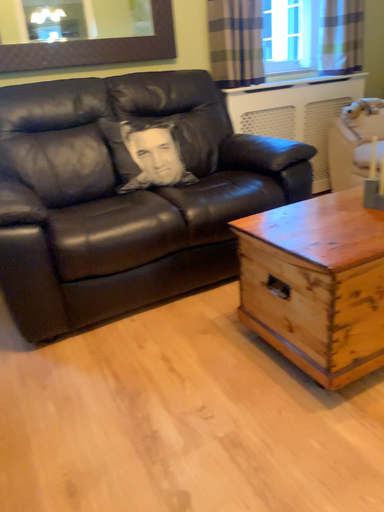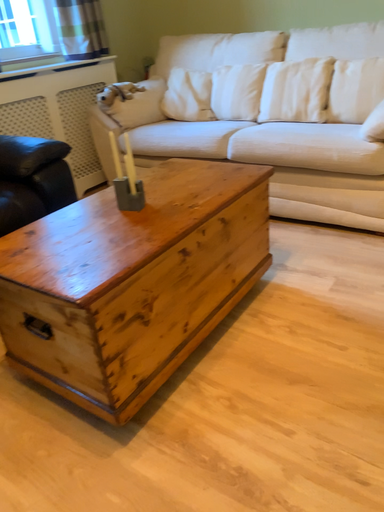
Question: How did the camera likely rotate when shooting the video?

Choices:
 (A) rotated right
 (B) rotated left

Answer: (A)